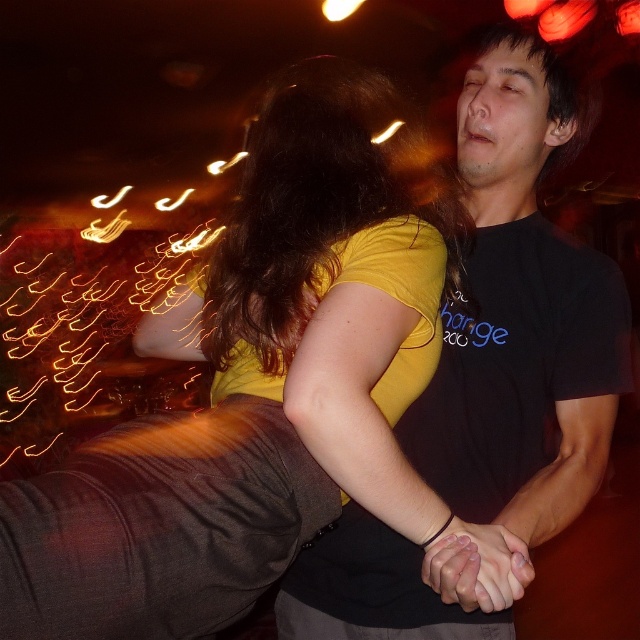
Consider the image. You are a photographer at a party and want to capture a photo of the two people in the scene. The camera you are using has a focus range that can only accommodate objects up to 15 cm in width. Given that the brown shiny hair at upper center is wider than the smooth skin hands at center, will the camera be able to focus on both objects simultaneously?

The brown shiny hair at upper center is wider than the smooth skin hands at center. Since the camera can only accommodate objects up to 15 cm in width, and the wider object exceeds this limit, the camera will not be able to focus on both objects simultaneously.